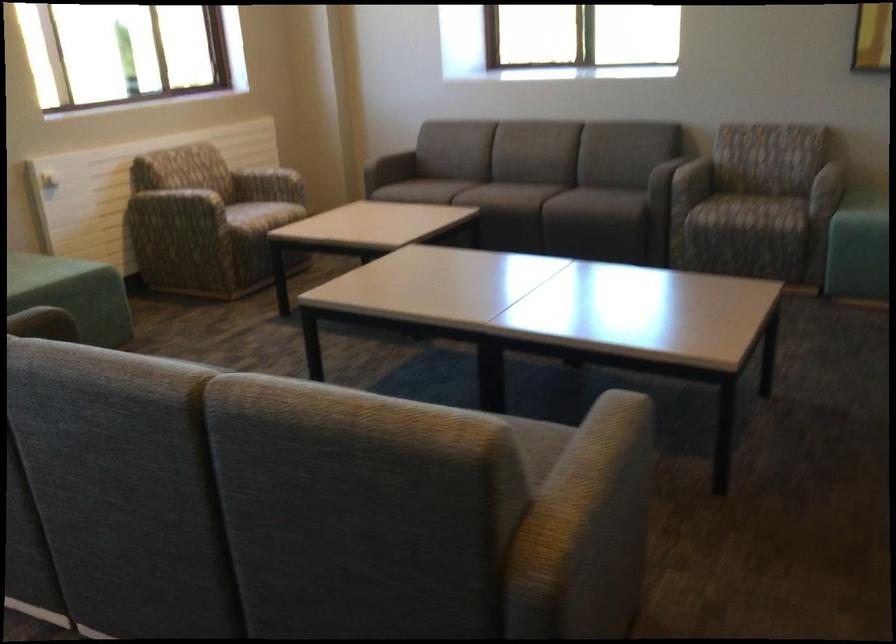
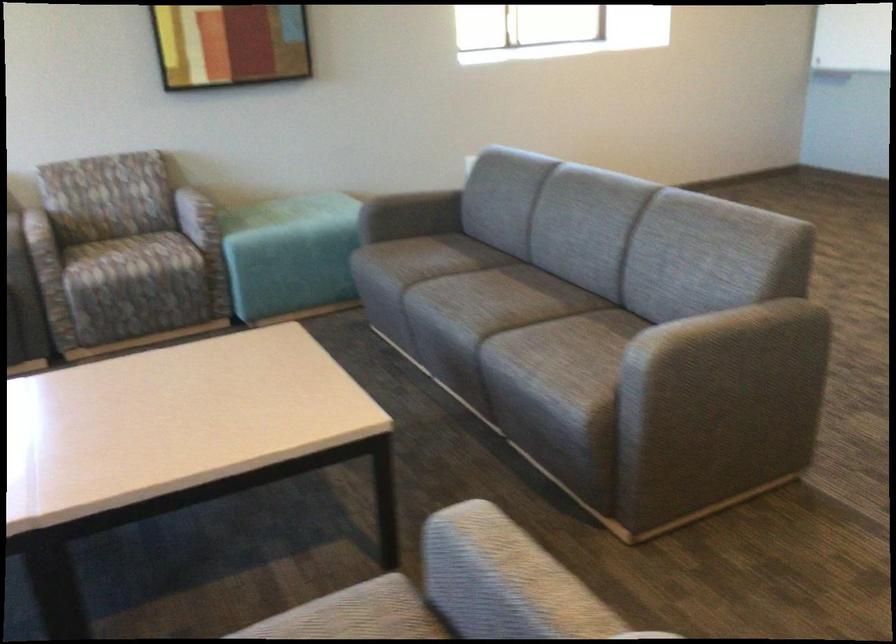
Find the pixel in the second image that matches [785,174] in the first image.

(197, 216)